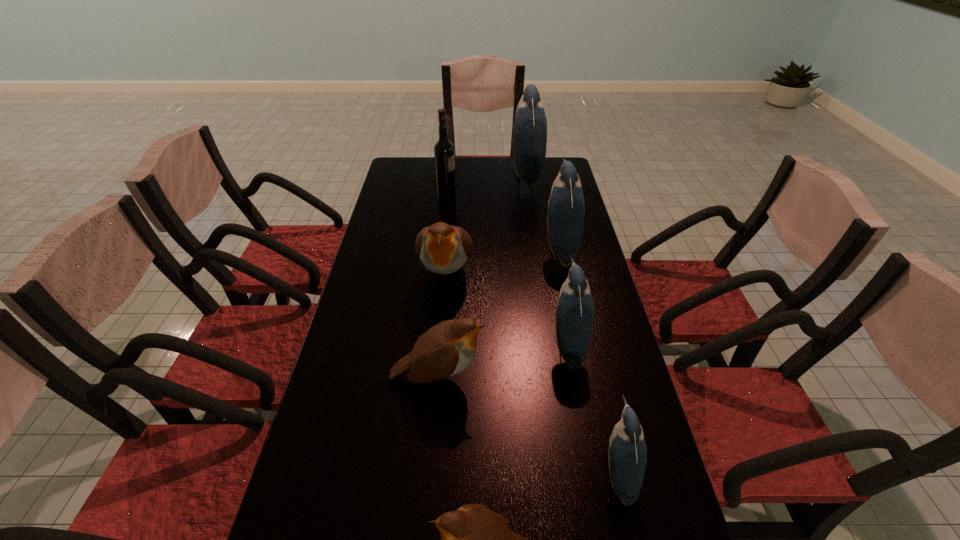
Identify the location of free space located at the tip of the second nearest blue bird's beak. (434, 344).

You are a GUI agent. You are given a task and a screenshot of the screen. Output one action in this format:
    pyautogui.click(x=<x>, y=<y>)
    Task: Click on the blank space located at the face of the second farthest brown bird
    This screenshot has height=540, width=960.
    Given the screenshot: What is the action you would take?
    pyautogui.click(x=531, y=377)

The image size is (960, 540). Identify the location of free region located at the tip of the sixth farthest bird's beak. (481, 471).

The image size is (960, 540). Find the location of `free point located at the tip of the sixth farthest bird's beak`. free point located at the tip of the sixth farthest bird's beak is located at coordinates (414, 471).

The width and height of the screenshot is (960, 540). What are the coordinates of `free location located at the tip of the sixth farthest bird's beak` in the screenshot? It's located at (486, 471).

You are a GUI agent. You are given a task and a screenshot of the screen. Output one action in this format:
    pyautogui.click(x=<x>, y=<y>)
    Task: Click on the object at the far edge
    
    Given the screenshot: What is the action you would take?
    pyautogui.click(x=530, y=126)

Where is `object that is positioned at the left edge`? object that is positioned at the left edge is located at coordinates click(446, 349).

At what (x,y) coordinates should I click in order to perform the action: click on object situated at the far right corner. Please return your answer as a coordinate pair (x, y). The width and height of the screenshot is (960, 540). Looking at the image, I should click on (530, 126).

Locate an element on the screen. The image size is (960, 540). free region at the far edge is located at coordinates (460, 163).

I want to click on free location at the left edge, so click(399, 212).